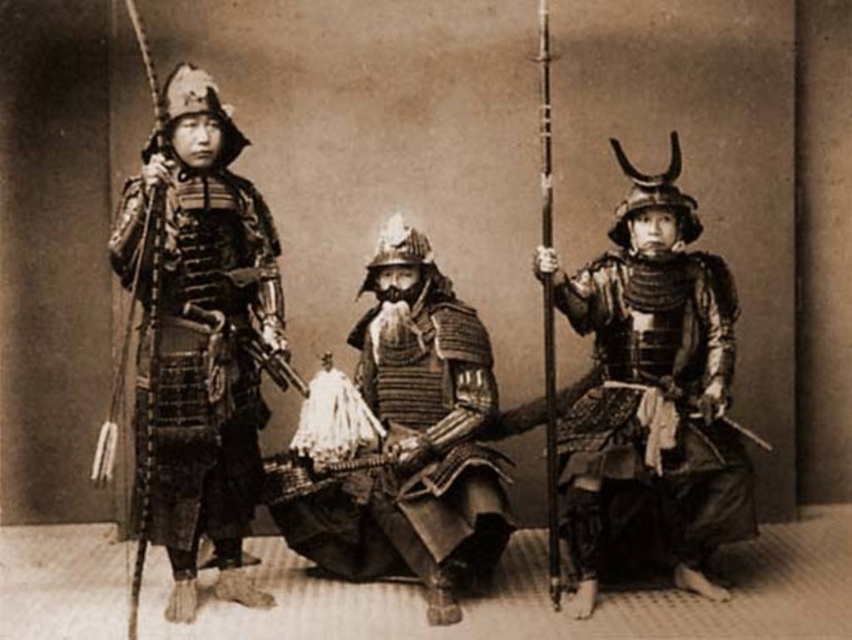
You are a historian examining this historical photograph of samurai. You notice two types of armor depicted here. The polished metal armor at left and the shiny metallic armor at center. Which of these two armors is positioned higher in the image?

The polished metal armor at left is located above the shiny metallic armor at center, so it is positioned higher in the image.

In the scene shown: You are an art conservator examining the photograph of the samurai. You need to determine which armor has a higher profile to plan the display case height. Which of the two armors, the polished metal armor at left or the shiny silver armor at right, is taller?

The polished metal armor at left has a greater height compared to the shiny silver armor at right, so the polished metal armor at left requires a taller display case.

You are a photographer setting up a tripod to take a closeup of both the shiny silver armor at right and the shiny metallic armor at center. The tripod has a fixed width of 22 inches between its legs. Will the tripod be able to fit both subjects within its span?

The shiny silver armor at right and shiny metallic armor at center are 22.15 inches apart from each other. Since the tripod has a fixed width of 22 inches between its legs, which is slightly narrower than the distance between the two armors, the tripod will not be able to fit both subjects within its span.